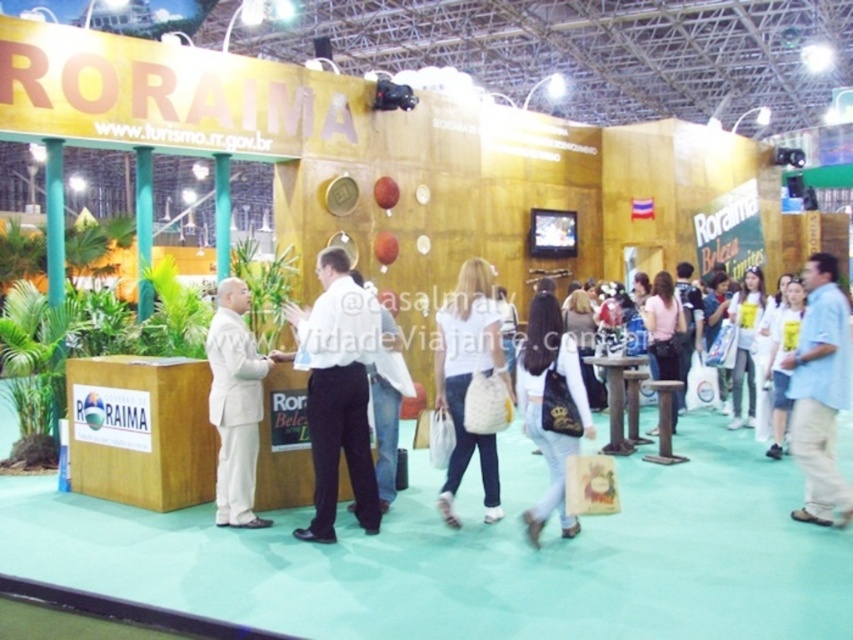
Is white smooth shirt at center smaller than pink fabric purse at center?

Correct, white smooth shirt at center occupies less space than pink fabric purse at center.

What do you see at coordinates (338, 394) in the screenshot?
I see `white smooth shirt at center` at bounding box center [338, 394].

The width and height of the screenshot is (853, 640). What are the coordinates of `white smooth shirt at center` in the screenshot? It's located at (338, 394).

Is white matte shirt at center taller than pink fabric purse at center?

No.

Is white matte shirt at center bigger than pink fabric purse at center?

Incorrect, white matte shirt at center is not larger than pink fabric purse at center.

Find the location of a particular element. The height and width of the screenshot is (640, 853). white matte shirt at center is located at coordinates (543, 406).

Is light blue shirt at right to the left of white woven bag at center from the viewer's perspective?

In fact, light blue shirt at right is to the right of white woven bag at center.

Between light blue shirt at right and white woven bag at center, which one is positioned lower?

Positioned lower is white woven bag at center.

Which is behind, point (791, 449) or point (473, 333)?

The point (473, 333) is behind.

Where is `light blue shirt at right`? This screenshot has width=853, height=640. light blue shirt at right is located at coordinates (820, 392).